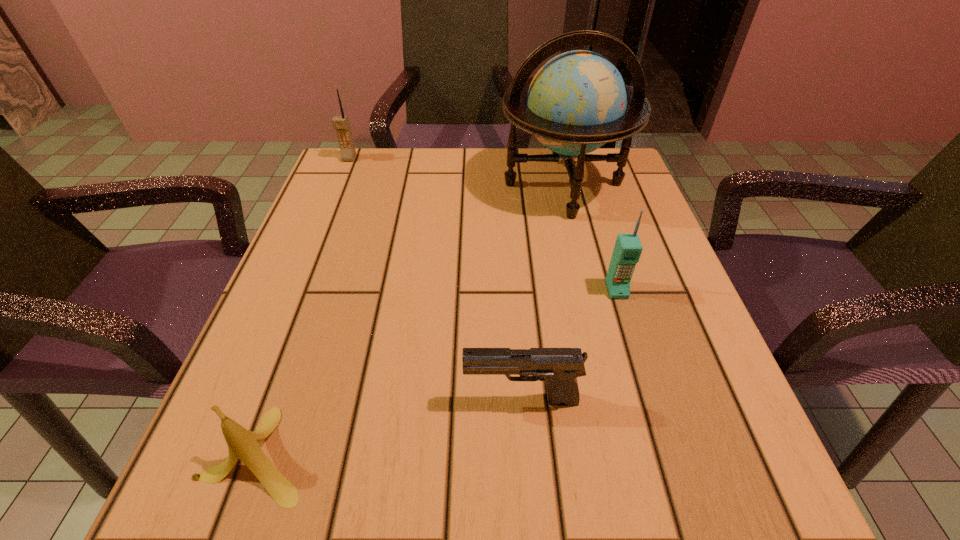
Identify the location of globe. (577, 102).

I want to click on the left cellular telephone, so click(341, 124).

Locate an element on the screen. The height and width of the screenshot is (540, 960). the nearer cellular telephone is located at coordinates (627, 250).

Image resolution: width=960 pixels, height=540 pixels. I want to click on the right cellular telephone, so click(x=627, y=250).

You are a GUI agent. You are given a task and a screenshot of the screen. Output one action in this format:
    pyautogui.click(x=<x>, y=<y>)
    Task: Click on the pistol
    
    Given the screenshot: What is the action you would take?
    pyautogui.click(x=559, y=367)

The width and height of the screenshot is (960, 540). What are the coordinates of `banana` in the screenshot? It's located at (243, 444).

This screenshot has width=960, height=540. Find the location of `blank area located on the surface of the tallest object`. blank area located on the surface of the tallest object is located at coordinates (609, 373).

The width and height of the screenshot is (960, 540). What are the coordinates of `vacant region located on the front of the farther cellular telephone, where the keypad is located` in the screenshot? It's located at (332, 199).

Where is `free region located on the keypad of the nearer cellular telephone`? Image resolution: width=960 pixels, height=540 pixels. free region located on the keypad of the nearer cellular telephone is located at coordinates (684, 513).

Where is `vacant space located 0.270m aim along the barrel of the pistol`? vacant space located 0.270m aim along the barrel of the pistol is located at coordinates (279, 401).